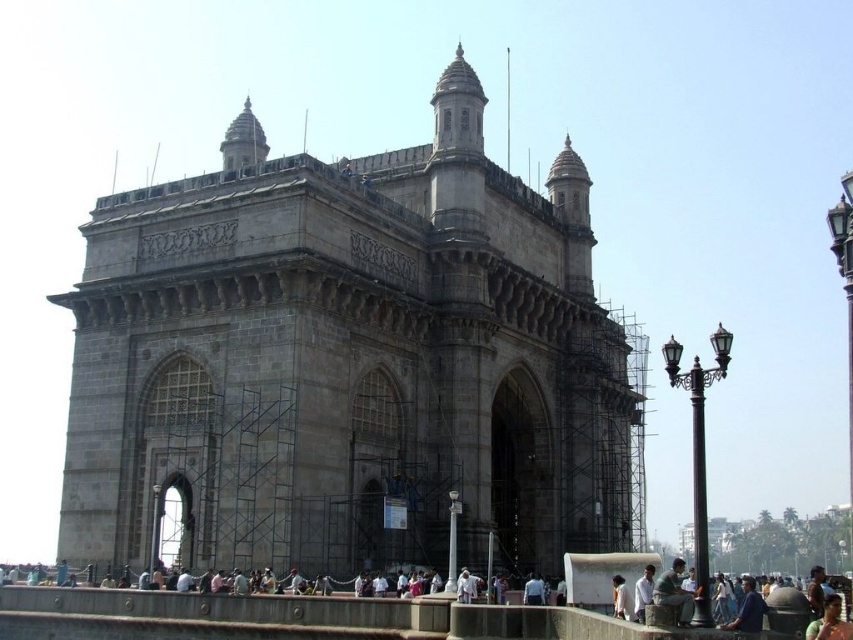
You are a tourist standing in front of the gray stone gateway of india at center and the light blue shirt at lower right. Which object is taller?

The gray stone gateway of india at center is taller than the light blue shirt at lower right.

Based on the coordinates provided, where is the gray stone gateway of india at center located in the image?

The gray stone gateway of india at center is located at the coordinates point (347, 360).

You are standing at the Gateway of India and want to take a photo of the crowd. There are two people marked as point (670, 596) and point (618, 582). Which person is closer to you?

Point (670, 596) is in front of point (618, 582), so the person at point (670, 596) is closer to you.